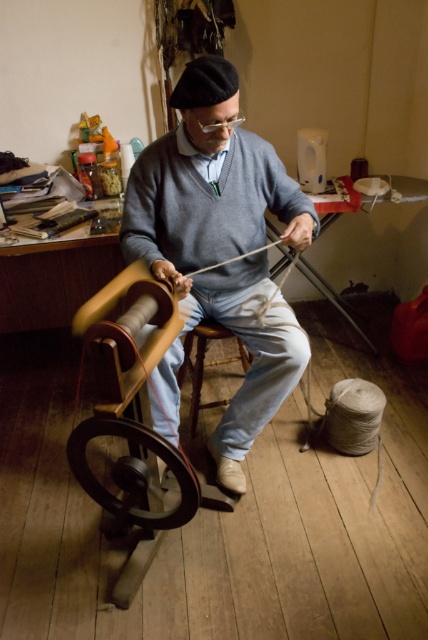
You are a tailor who needs to choose between the gray wool sweater at center and the wooden wheel at lower left to place on a small shelf. Which item would you choose and why?

The gray wool sweater at center is larger in size than the wooden wheel at lower left, so the wooden wheel at lower left would fit better on the small shelf.